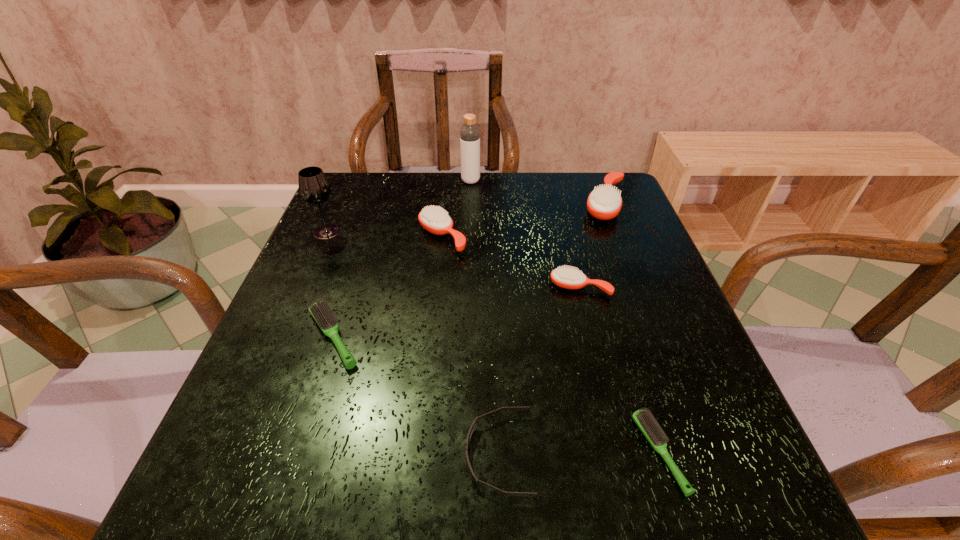
You are a GUI agent. You are given a task and a screenshot of the screen. Output one action in this format:
    pyautogui.click(x=<x>, y=<y>)
    Task: Click on the left light hairbrush
    
    Given the screenshot: What is the action you would take?
    click(x=321, y=312)

Where is `the shortest hairbrush`? This screenshot has height=540, width=960. the shortest hairbrush is located at coordinates (644, 420).

Locate an element on the screen. Image resolution: width=960 pixels, height=540 pixels. the smaller light hairbrush is located at coordinates (644, 420).

Identify the location of sunglasses. The height and width of the screenshot is (540, 960). (470, 432).

Identify the location of vacant area located 0.140m on the front of the gray bottle. (469, 213).

The image size is (960, 540). I want to click on free space located 0.050m on the right of the second tallest object, so click(361, 232).

Where is `vacant region located 0.290m on the left of the biggest orange hairbrush`? vacant region located 0.290m on the left of the biggest orange hairbrush is located at coordinates (474, 204).

Identify the location of vacant space situated on the right of the fourth shortest hairbrush. 537,237.

Where is `vacant space located on the left of the third farthest hairbrush`? vacant space located on the left of the third farthest hairbrush is located at coordinates pos(411,287).

The width and height of the screenshot is (960, 540). I want to click on blank area located 0.120m on the front of the leftmost hairbrush, so click(x=302, y=434).